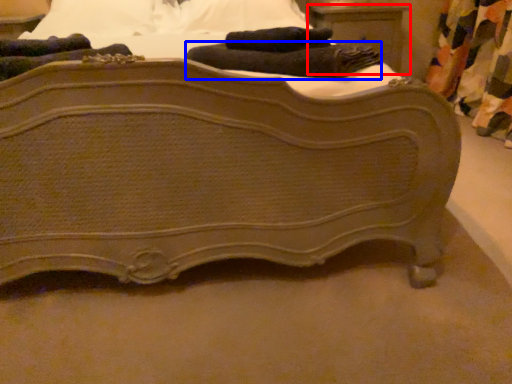
Question: Which point is closer to the camera, nightstand (highlighted by a red box) or bath towel (highlighted by a blue box)?

Choices:
 (A) nightstand
 (B) bath towel

Answer: (B)